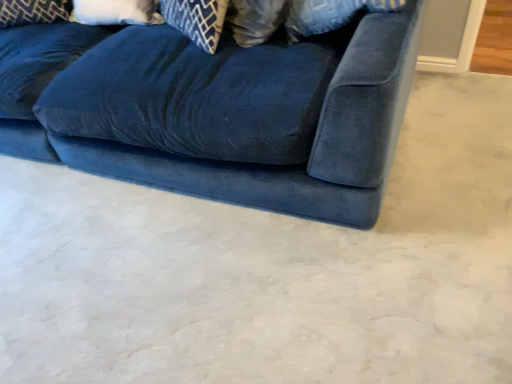
Question: In the image, is velvet blue couch at center positioned in front of or behind velvet blue pillow at upper left, arranged as the first pillow when viewed from the left?

Choices:
 (A) behind
 (B) front

Answer: (B)

Question: Visually, is velvet blue couch at center positioned to the left or to the right of velvet blue pillow at upper left, arranged as the first pillow when viewed from the left?

Choices:
 (A) right
 (B) left

Answer: (A)

Question: Which object is positioned farthest from the white soft pillow at upper left, the first pillow when ordered from right to left?

Choices:
 (A) velvet blue pillow at upper left, arranged as the first pillow when viewed from the left
 (B) velvet blue couch at center

Answer: (B)

Question: Considering the real-world distances, which object is farthest from the white soft pillow at upper left, the first pillow when ordered from right to left?

Choices:
 (A) velvet blue pillow at upper left, which is the second pillow from right to left
 (B) velvet blue couch at center

Answer: (B)